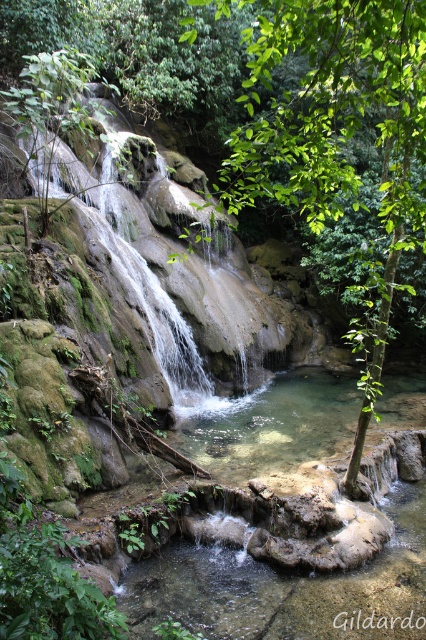
Question: Among these points, which one is farthest from the camera?

Choices:
 (A) (317, 0)
 (B) (120, 227)

Answer: (B)

Question: Is green leafy tree at center further to the viewer compared to green mossy rock at center?

Choices:
 (A) no
 (B) yes

Answer: (A)

Question: Among these objects, which one is nearest to the camera?

Choices:
 (A) green mossy rock at center
 (B) green leafy tree at center

Answer: (B)

Question: From the image, what is the correct spatial relationship of green leafy tree at center in relation to green mossy rock at center?

Choices:
 (A) below
 (B) above

Answer: (A)

Question: Can you confirm if green leafy tree at center is thinner than green mossy rock at center?

Choices:
 (A) no
 (B) yes

Answer: (A)

Question: Which of the following is the closest to the observer?

Choices:
 (A) (391, 116)
 (B) (83, 182)

Answer: (A)